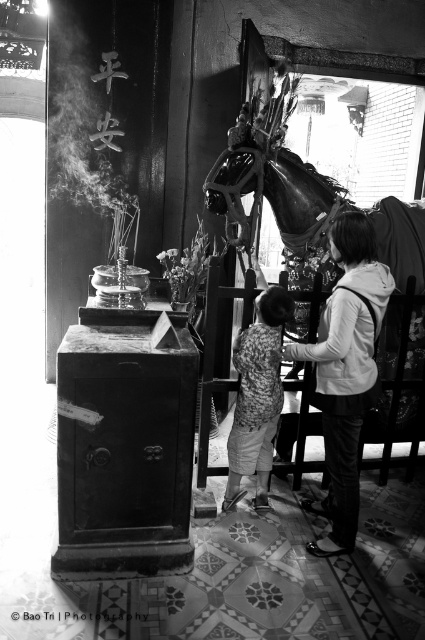
Is matte gray hoodie at center smaller than printed fabric shirt at center?

Incorrect, matte gray hoodie at center is not smaller in size than printed fabric shirt at center.

Is point (346, 429) positioned in front of point (251, 436)?

Yes, point (346, 429) is in front of point (251, 436).

Locate an element on the screen. This screenshot has height=640, width=425. matte gray hoodie at center is located at coordinates (345, 371).